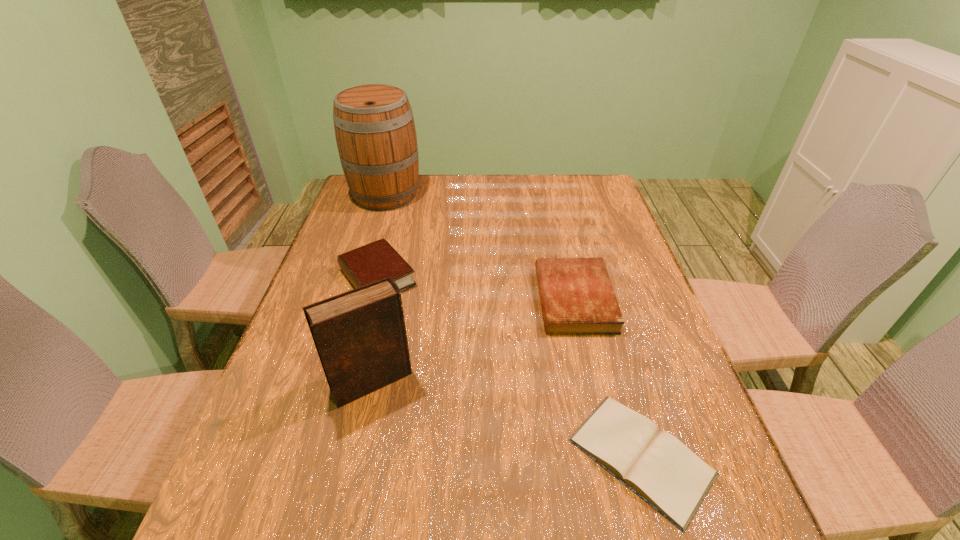
Identify the location of free space at the right edge of the desktop. The height and width of the screenshot is (540, 960). (608, 353).

Where is `free space at the near left corner`? The width and height of the screenshot is (960, 540). free space at the near left corner is located at coordinates (301, 530).

Identify the location of free spot at the far right corner of the desktop. (588, 188).

Image resolution: width=960 pixels, height=540 pixels. What are the coordinates of `empty space that is in between the third shortest object and the farthest object` in the screenshot? It's located at (381, 236).

Where is `free spot between the second shortest Bible and the tallest object`? The image size is (960, 540). free spot between the second shortest Bible and the tallest object is located at coordinates (480, 247).

Identify the location of vacant point located between the third tallest Bible and the farthest object. This screenshot has height=540, width=960. (480, 247).

Find the location of `unoccupied area between the shortest object and the third shortest object`. unoccupied area between the shortest object and the third shortest object is located at coordinates (509, 367).

You are a GUI agent. You are given a task and a screenshot of the screen. Output one action in this format:
    pyautogui.click(x=<x>, y=<y>)
    Task: Click on the unoccupied position between the third shortest object and the second shortest object
    The width and height of the screenshot is (960, 540).
    Given the screenshot: What is the action you would take?
    pyautogui.click(x=476, y=288)

Image resolution: width=960 pixels, height=540 pixels. In order to click on free area in between the shortest Bible and the tallest Bible in this screenshot , I will do `click(507, 419)`.

Find the location of `free space between the second shortest Bible and the second tallest Bible`. free space between the second shortest Bible and the second tallest Bible is located at coordinates (476, 288).